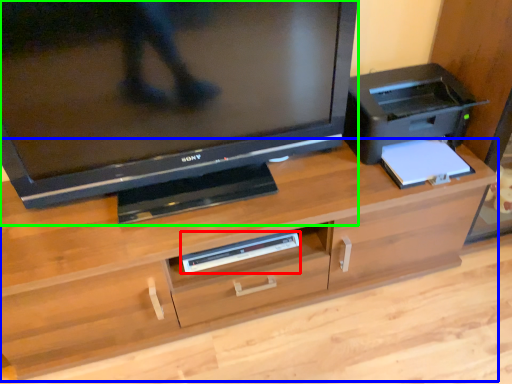
Question: Based on their relative distances, which object is nearer to equipment (highlighted by a red box)? Choose from desk (highlighted by a blue box) and television (highlighted by a green box).

Choices:
 (A) desk
 (B) television

Answer: (A)